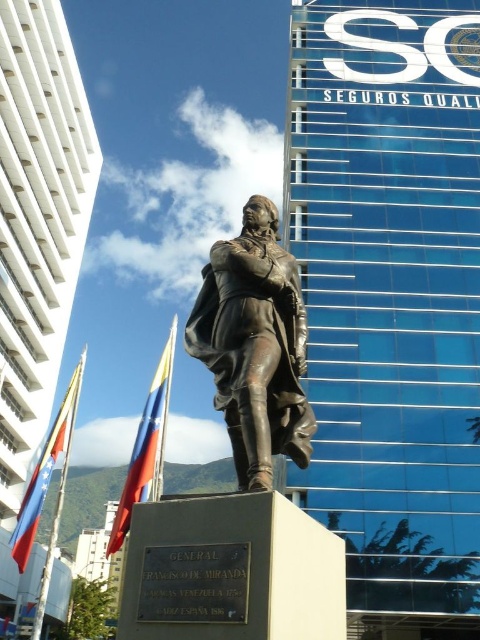
Looking at this image, you are a photographer trying to capture both the red fabric flag at center and the red fabric flag at lower left in a single shot. However, you notice that one of them is blocking the view of the other. Which flag is blocking the other one?

The red fabric flag at center is in front of red fabric flag at lower left, so it is blocking the view of the red fabric flag at lower left.

In the scene shown: You are standing in front of the bronze statue of General Francisco de Miranda in front of the SEGUROS QUALI building. There are two points marked on the statue. Which point, point (x=254, y=422) or point (x=63, y=403), is closer to you?

Point (x=254, y=422) is closer to the viewer than point (x=63, y=403).

You are a photographer standing at the statue of General Francisco de Miranda. You want to take a photo that includes both the red fabric flag at center and the red fabric flag at lower left. Considering their distance apart, will you be able to capture both flags in a single frame without moving the camera?

The red fabric flag at center is 56.64 feet away from the red fabric flag at lower left. Since the distance between them is significant, it depends on the camera lens used. A wide angle lens could potentially capture both in one frame, but a standard or telephoto lens might not. However, without specific information about the camera and lens specifications, it is difficult to confirm definitively.